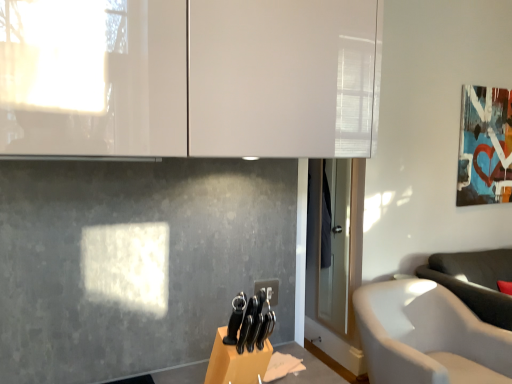
Question: Can you confirm if white glossy cabinet at upper center is positioned to the left of white fabric chair at lower right?

Choices:
 (A) no
 (B) yes

Answer: (B)

Question: Is white glossy cabinet at upper center facing away from white fabric chair at lower right?

Choices:
 (A) no
 (B) yes

Answer: (A)

Question: Could you tell me if white glossy cabinet at upper center is facing white fabric chair at lower right?

Choices:
 (A) yes
 (B) no

Answer: (B)

Question: Is white glossy cabinet at upper center positioned behind white fabric chair at lower right?

Choices:
 (A) no
 (B) yes

Answer: (A)

Question: Is white glossy cabinet at upper center far away from white fabric chair at lower right?

Choices:
 (A) yes
 (B) no

Answer: (A)

Question: From a real-world perspective, relative to white fabric chair at lower right, is white glossy cabinet at upper center vertically above or below?

Choices:
 (A) below
 (B) above

Answer: (B)

Question: Is white glossy cabinet at upper center taller or shorter than white fabric chair at lower right?

Choices:
 (A) tall
 (B) short

Answer: (B)

Question: In the image, is white glossy cabinet at upper center positioned in front of or behind white fabric chair at lower right?

Choices:
 (A) front
 (B) behind

Answer: (A)

Question: Considering the positions of white glossy cabinet at upper center and white fabric chair at lower right in the image, is white glossy cabinet at upper center wider or thinner than white fabric chair at lower right?

Choices:
 (A) thin
 (B) wide

Answer: (A)

Question: Considering the relative positions of matte acrylic picture frame at upper right and white glossy cabinet at upper center in the image provided, is matte acrylic picture frame at upper right to the left or to the right of white glossy cabinet at upper center?

Choices:
 (A) right
 (B) left

Answer: (A)

Question: Do you think matte acrylic picture frame at upper right is within white glossy cabinet at upper center, or outside of it?

Choices:
 (A) inside
 (B) outside

Answer: (B)

Question: In terms of height, does matte acrylic picture frame at upper right look taller or shorter compared to white glossy cabinet at upper center?

Choices:
 (A) tall
 (B) short

Answer: (A)

Question: Looking at the image, does matte acrylic picture frame at upper right seem bigger or smaller compared to white glossy cabinet at upper center?

Choices:
 (A) small
 (B) big

Answer: (A)

Question: Is white glossy cabinet at upper center wider or thinner than matte acrylic picture frame at upper right?

Choices:
 (A) wide
 (B) thin

Answer: (A)

Question: From a real-world perspective, relative to matte acrylic picture frame at upper right, is white glossy cabinet at upper center vertically above or below?

Choices:
 (A) below
 (B) above

Answer: (B)